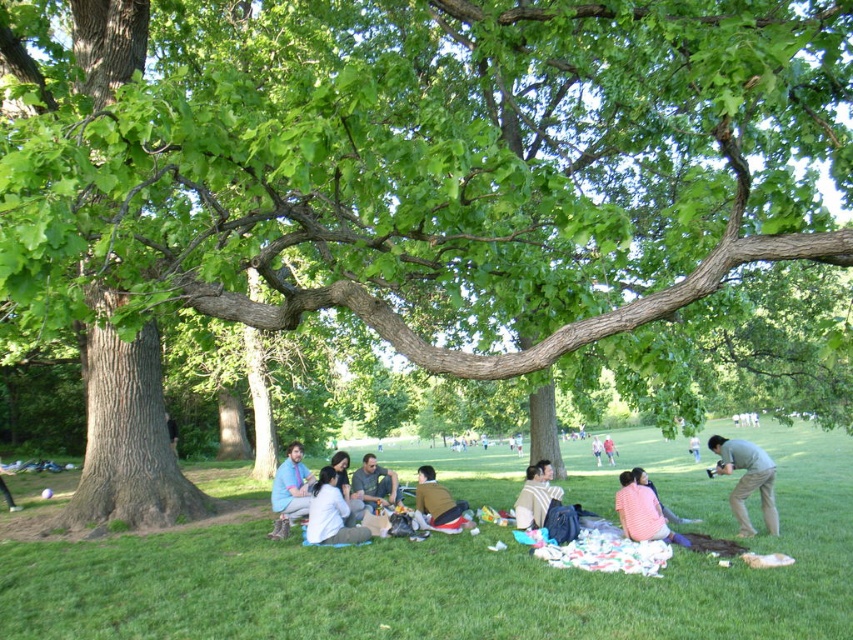
You are standing at the picnic blanket and want to place a small basket. The picnic blanket is located at point (445, 579). Where should you place the basket so it stays on the picnic blanket?

The picnic blanket is located at point (445, 579), so placing the basket at that point would keep it on the picnic blanket.

You are standing in the park and looking at the picnic scene. There are two points marked in the image. The first point is at coordinates point (22,554) and the second is at point (666,509). Which point is closer to you?

Point (22,554) is closer to the camera than point (666,509), so the first point is closer to you.